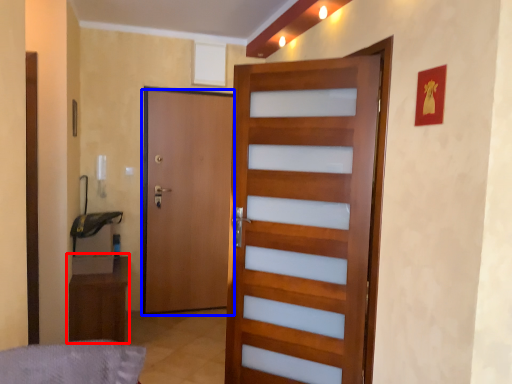
Question: Which of the following is the closest to the observer, furniture (highlighted by a red box) or door (highlighted by a blue box)?

Choices:
 (A) furniture
 (B) door

Answer: (A)